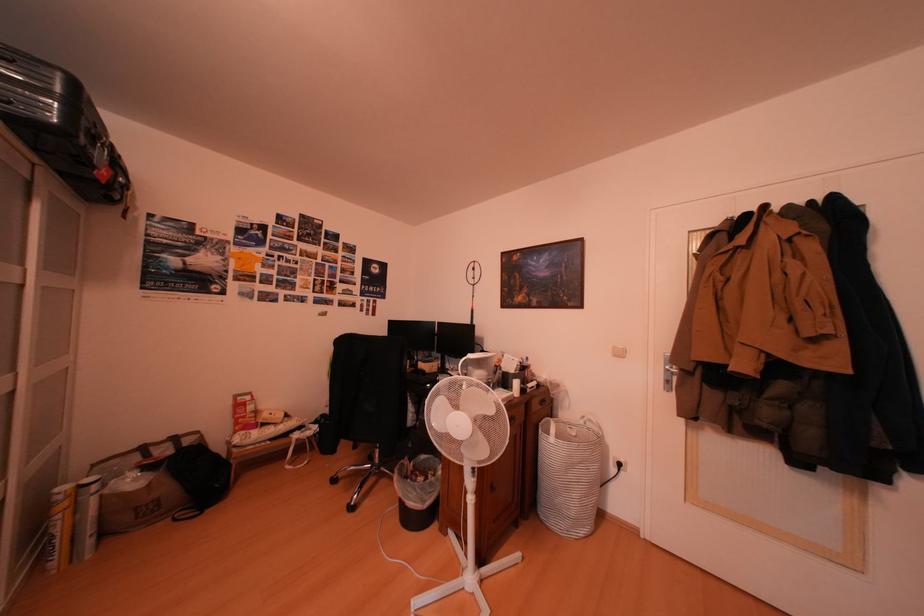
Find the location of `fan control buttons`. fan control buttons is located at coordinates (469, 477).